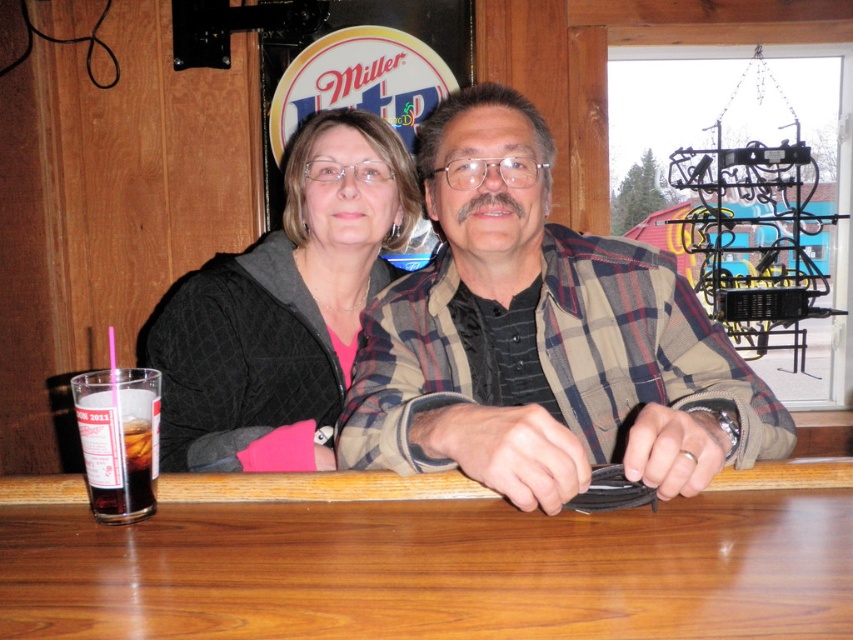
From the picture: You are a photographer setting up a shoot in this dining area. You need to place a 12 inch wide light panel between the plaid flannel shirt at center and the black quilted jacket at upper left. Based on their widths, will the light panel fit between them without overlapping either?

The plaid flannel shirt at center is wider than the black quilted jacket at upper left. Since the light panel is 12 inches wide, it can fit between them as long as the total available space between the two objects is at least 12 inches. However, the exact placement would depend on their actual spacing, which isn

In the scene shown: You are a server at the bar and need to deliver a drink to the customer wearing the black quilted jacket at upper left. The drink is currently on the brown wood table at center. Can you place the drink directly in front of the customer without moving the table?

The brown wood table at center is located below the black quilted jacket at upper left, so placing the drink directly in front of the customer would require moving the table since the table is underneath the jacket wearer.

You are a server at the dining establishment and need to place a large tray of food on the brown wood table at center. However, the black quilted jacket at upper left is currently occupying space on the table. Can you fit the tray on the table without moving the jacket?

The brown wood table at center is wider than the black quilted jacket at upper left, so there should be enough space to place the large tray of food on the table without moving the jacket.